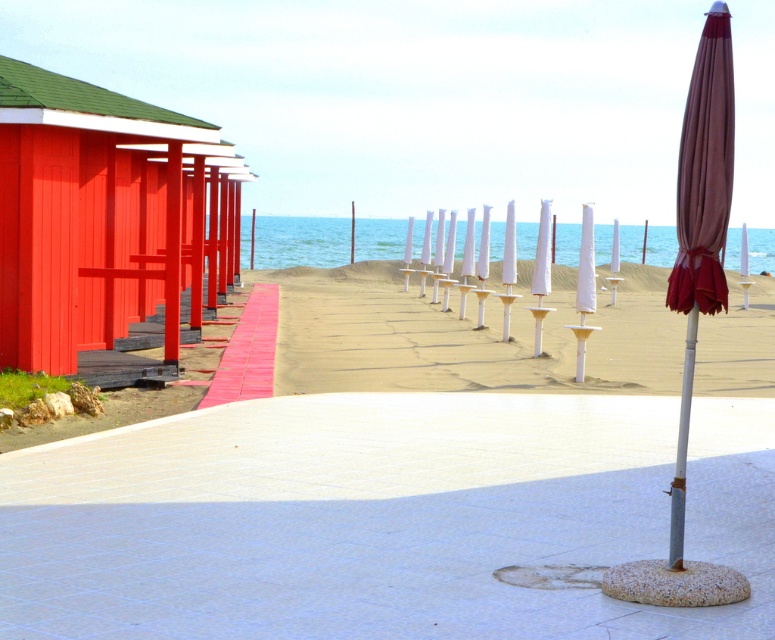
Question: Which object appears closest to the camera in this image?

Choices:
 (A) brown fabric umbrella at center right
 (B) red brick walkway at left
 (C) white concrete path at center
 (D) beige sand at center

Answer: (A)

Question: Which point is closer to the camera?

Choices:
 (A) (67, 280)
 (B) (346, 227)
 (C) (12, 451)
 (D) (226, 380)

Answer: (C)

Question: Does white concrete path at center have a smaller size compared to blue water at center?

Choices:
 (A) no
 (B) yes

Answer: (B)

Question: Is white concrete path at center above beige sand at center?

Choices:
 (A) no
 (B) yes

Answer: (A)

Question: Does white concrete path at center appear over beige sand at center?

Choices:
 (A) yes
 (B) no

Answer: (B)

Question: Which of the following is the closest to the observer?

Choices:
 (A) red brick walkway at left
 (B) matte red wooden beach hut at left

Answer: (B)